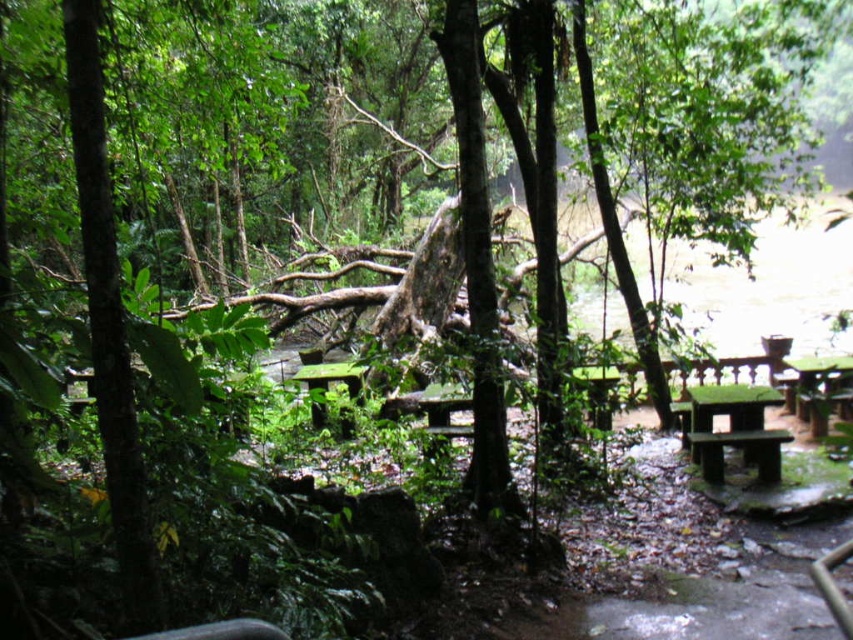
You are planning to have a picnic in the forest clearing. You see the green mossy bench at lower right and the green matte table at right. Which object is wider? Please choose between the two.

The green mossy bench at lower right is wider than the green matte table at right according to the description.

You are a hiker carrying a backpack weighing 20 kilograms. You want to rest and place your backpack on the nearest surface. Which object between the green mossy bench at lower right and the green matte table at right is closer to you?

The green mossy bench at lower right is closer to you since it is positioned at lower right, which is typically closer to the viewer compared to the green matte table at right located further away. However, according to the description, the distance between them is 1.75 meters, so you can choose either depending on your preference.

You are planning to have a picnic in this forest clearing and want to set up your blanket. The green mossy bench at lower right and the green mossy table at center are both in the way. Which object should you move first to clear the path to the table?

You should move the green mossy bench at lower right first because it is in front of the green mossy table at center, so moving it will allow access to the table.